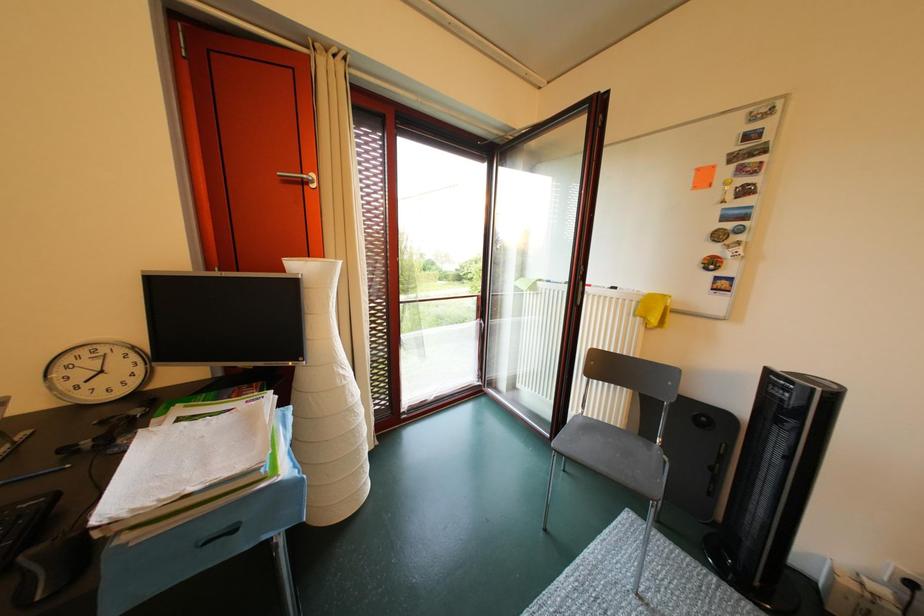
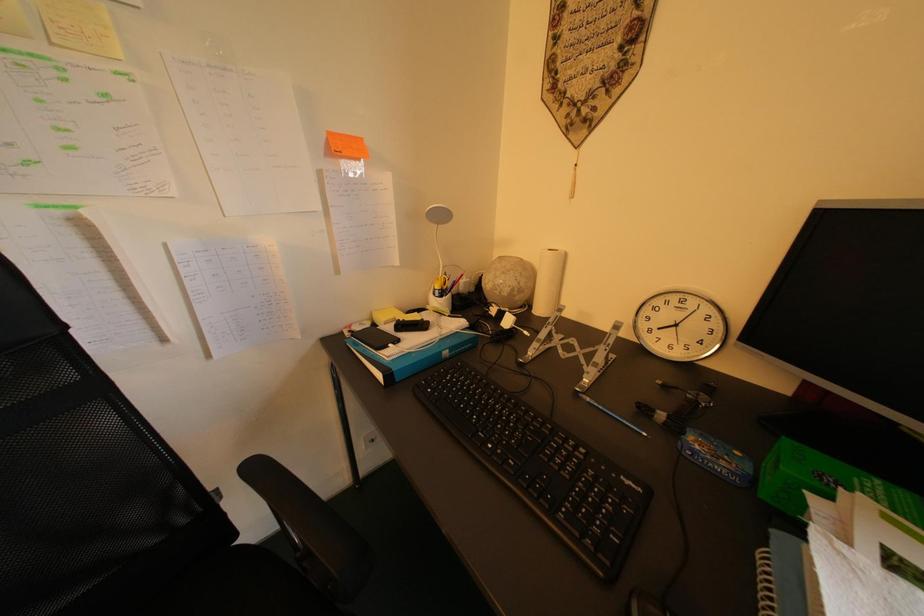
The first image is from the beginning of the video and the second image is from the end. How did the camera likely rotate when shooting the video?

The camera rotated toward left-down.